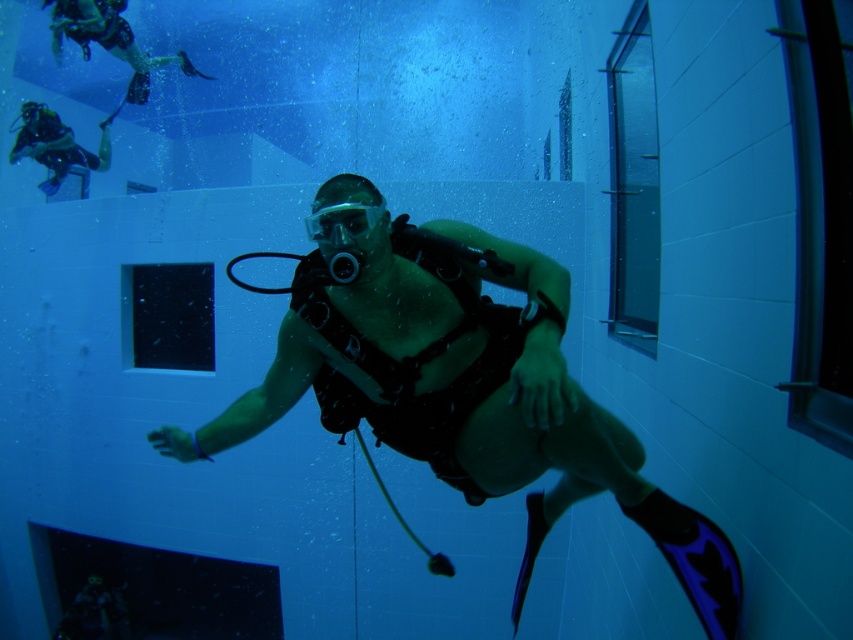
Who is more forward, (219,449) or (346,209)?

Positioned in front is point (346,209).

Can you confirm if matte black scuba gear at center is positioned below clear plastic goggles at center?

Correct, matte black scuba gear at center is located below clear plastic goggles at center.

This screenshot has height=640, width=853. I want to click on matte black scuba gear at center, so click(x=461, y=385).